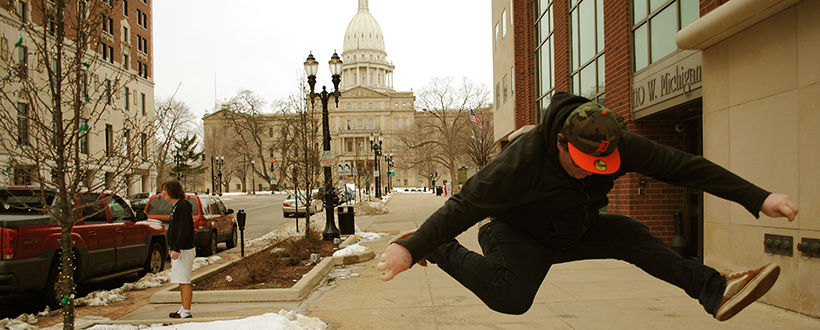
The height and width of the screenshot is (330, 820). Find the location of `windows`. windows is located at coordinates (666, 39), (589, 32), (541, 56), (507, 32), (490, 36), (493, 94), (507, 93).